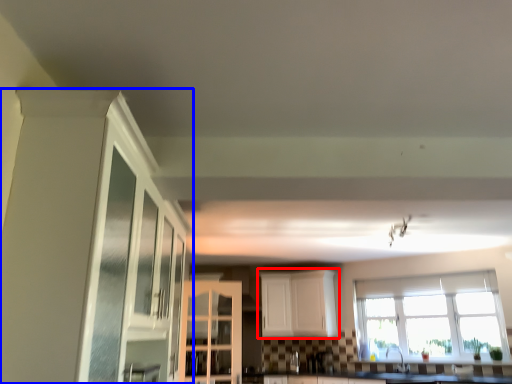
Question: Among these objects, which one is nearest to the camera, cabinetry (highlighted by a red box) or cabinetry (highlighted by a blue box)?

Choices:
 (A) cabinetry
 (B) cabinetry

Answer: (B)